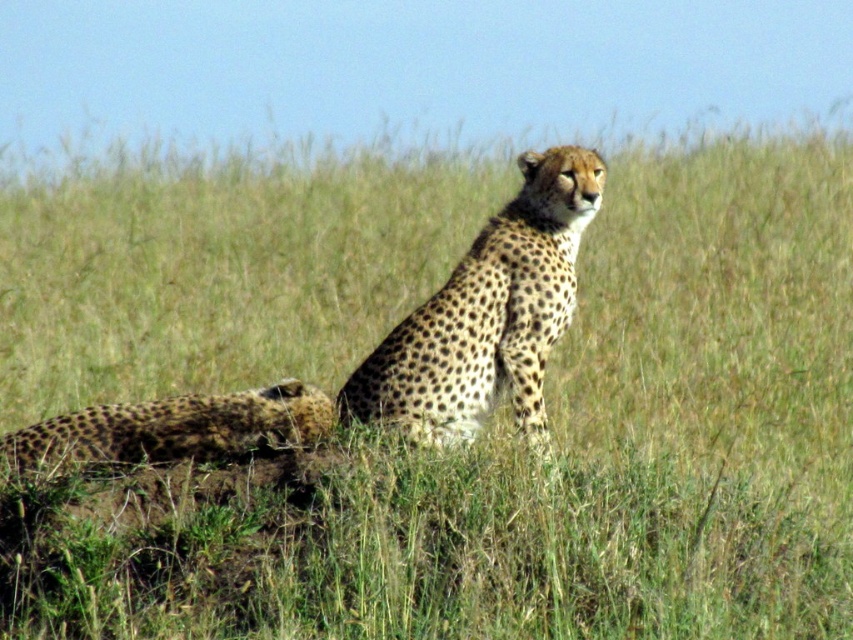
Between spotted fur cheetah at center and spotted fur cheetah at lower left, which one is positioned higher?

spotted fur cheetah at center is above.

Is spotted fur cheetah at center above spotted fur cheetah at lower left?

Yes, spotted fur cheetah at center is above spotted fur cheetah at lower left.

The height and width of the screenshot is (640, 853). Describe the element at coordinates (486, 316) in the screenshot. I see `spotted fur cheetah at center` at that location.

Identify the location of spotted fur cheetah at center. This screenshot has height=640, width=853. (486, 316).